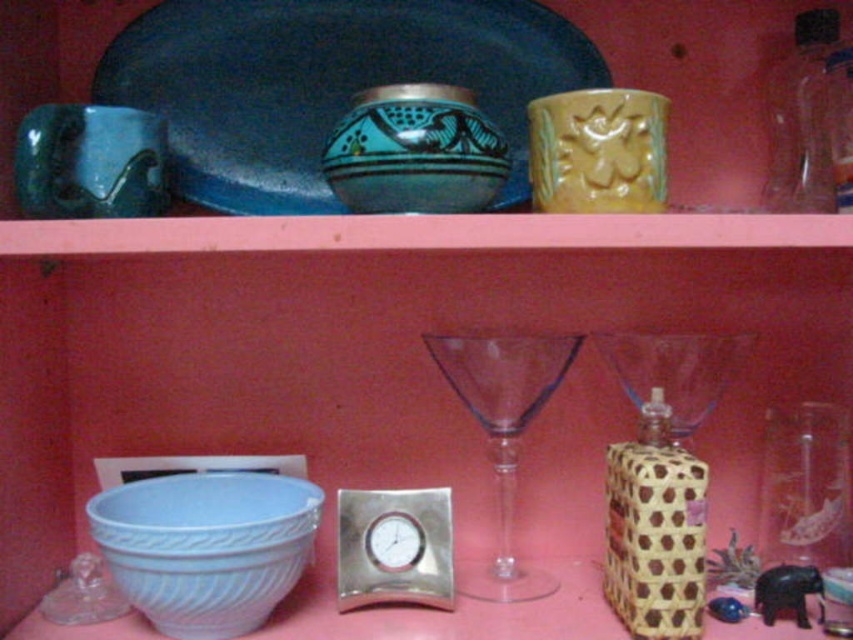
In the scene shown: You are standing in front of the shelf and want to reach two points marked on the shelf. The first point is at coordinate point (578, 106) and the second point is at coordinate point (73, 189). Which point is closer to you?

Point (578, 106) is closer to the viewer than point (73, 189).

You are arranging flowers in a vase and need to place it between the matte blue cup at upper left and the transparent glass wine glass at center. Is there enough space between them to fit a standard 10cm wide vase?

The matte blue cup at upper left is to the left of transparent glass wine glass at center, but the distance between them isn not specified in the objects description. Therefore, it is unclear if there is enough space to fit a standard 10cm wide vase.

You are arranging flowers in the image. You have a bouquet that needs to be placed between the matte blue cup at upper left and the transparent glass wine glass at center. Can you fit the bouquet there without moving either object?

The matte blue cup at upper left is in front of the transparent glass wine glass at center, so there is space between them to place the bouquet without moving either object.